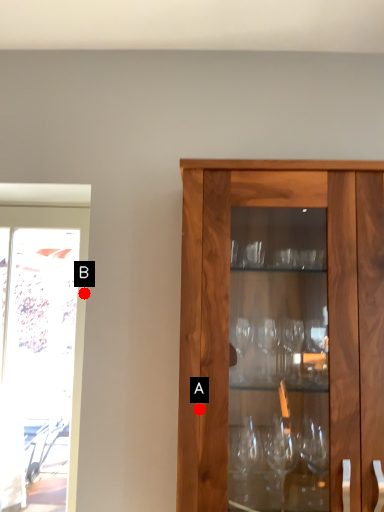
Question: Two points are circled on the image, labeled by A and B beside each circle. Which point is closer to the camera?

Choices:
 (A) A is closer
 (B) B is closer

Answer: (A)